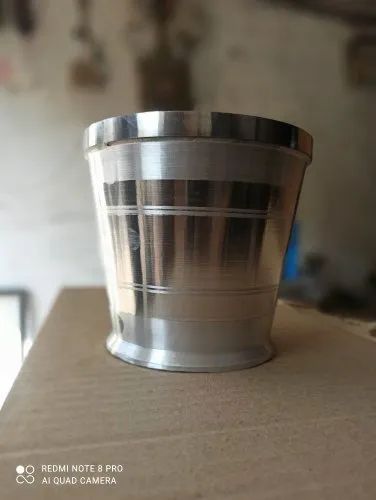
The width and height of the screenshot is (376, 500). What are the coordinates of `whiteboard` in the screenshot? It's located at (13, 329).